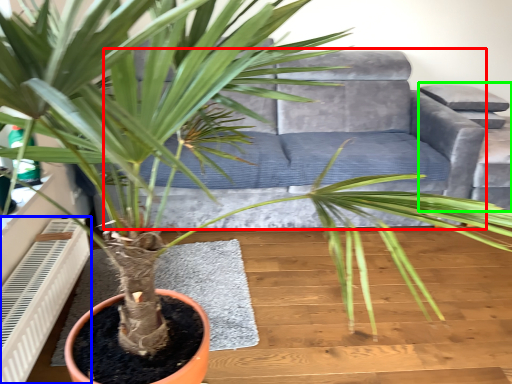
Question: Which object is positioned closest to couch (highlighted by a red box)? Select from air conditioner (highlighted by a blue box) and armchair (highlighted by a green box).

Choices:
 (A) air conditioner
 (B) armchair

Answer: (B)